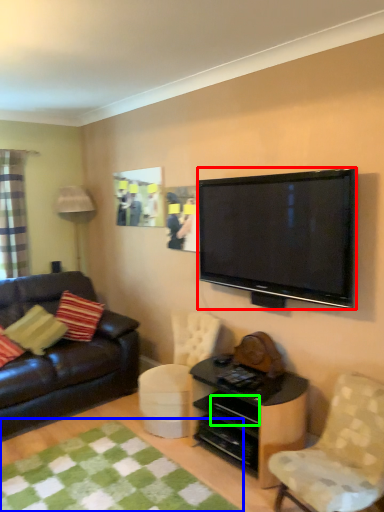
Question: Considering the real-world distances, which object is closest to television (highlighted by a red box)? mat (highlighted by a blue box) or drawer (highlighted by a green box).

Choices:
 (A) mat
 (B) drawer

Answer: (B)